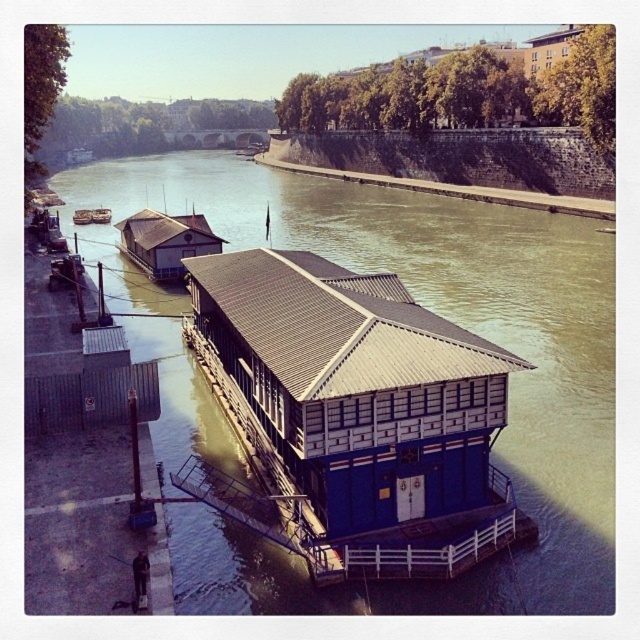
Question: Which object is farther from the camera taking this photo?

Choices:
 (A) wooden cabin at left
 (B) wooden boat at left
 (C) wooden hut at upper left

Answer: (A)

Question: Among these points, which one is farthest from the camera?

Choices:
 (A) (474, 387)
 (B) (90, 221)

Answer: (B)

Question: Is blue wooden houseboat at center closer to the viewer compared to wooden hut at upper left?

Choices:
 (A) yes
 (B) no

Answer: (A)

Question: Is blue wooden houseboat at center to the left of wooden cabin at left from the viewer's perspective?

Choices:
 (A) yes
 (B) no

Answer: (B)

Question: Which point is closer to the camera?

Choices:
 (A) wooden hut at upper left
 (B) wooden boat at left
 (C) blue wooden hut at center
 (D) blue wooden houseboat at center

Answer: (C)

Question: Observing the image, what is the correct spatial positioning of blue wooden houseboat at center in reference to wooden hut at upper left?

Choices:
 (A) left
 (B) right

Answer: (B)